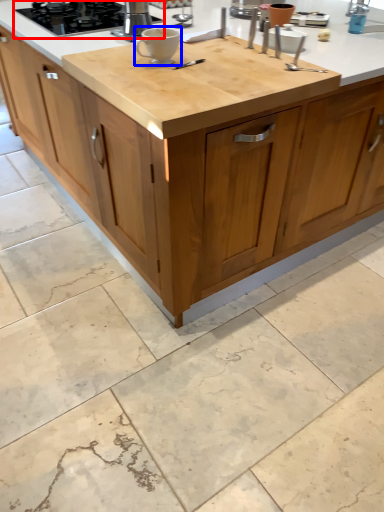
Question: Which of the following is the closest to the observer, gas stove (highlighted by a red box) or coffee cup (highlighted by a blue box)?

Choices:
 (A) gas stove
 (B) coffee cup

Answer: (B)